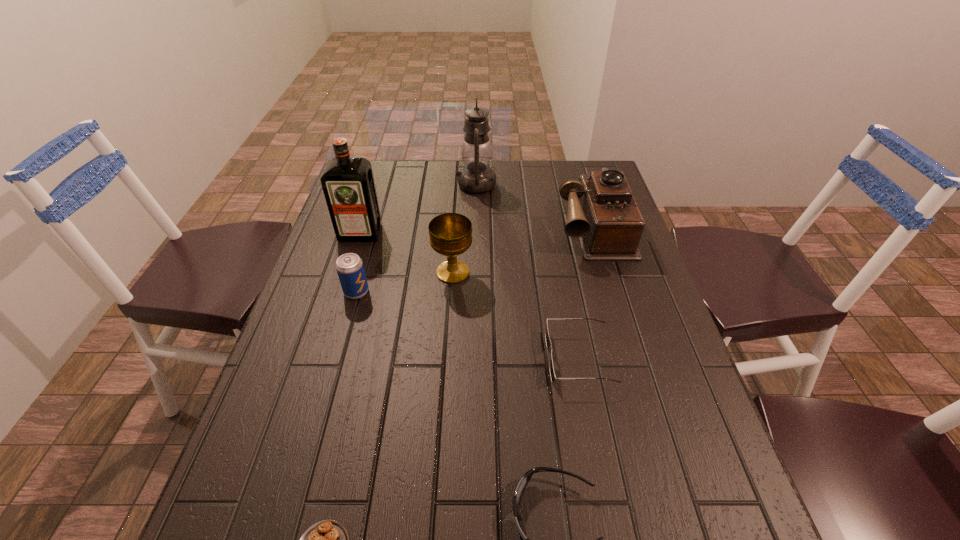
The height and width of the screenshot is (540, 960). In the image, there is a desktop. Identify the location of free space at the left edge. (321, 254).

What are the coordinates of `free space at the right edge of the desktop` in the screenshot? It's located at (636, 446).

Identify the location of vacant space that's between the chalice and the liquor. This screenshot has height=540, width=960. (407, 253).

Find the location of `free space between the fourth shortest object and the oil lamp`. free space between the fourth shortest object and the oil lamp is located at coordinates (417, 238).

Identify the location of empty space between the beer can and the farther sunglasses. (468, 325).

Find the location of `vacant space that's between the beer can and the oil lamp`. vacant space that's between the beer can and the oil lamp is located at coordinates coord(417,238).

Locate an element on the screen. free space between the farther sunglasses and the phonograph_record is located at coordinates (587, 293).

Find the location of a particular element. This screenshot has width=960, height=540. object that is the third closest to the chalice is located at coordinates (548, 342).

Identify which object is the fifth closest to the third nearest object. Please provide its 2D coordinates. Your answer should be formatted as a tuple, i.e. [(x, y)], where the tuple contains the x and y coordinates of a point satisfying the conditions above.

[(349, 266)]

I want to click on vacant space that satisfies the following two spatial constraints: 1. on the horn of the phonograph_record; 2. on the front-facing side of the farther sunglasses, so click(x=632, y=358).